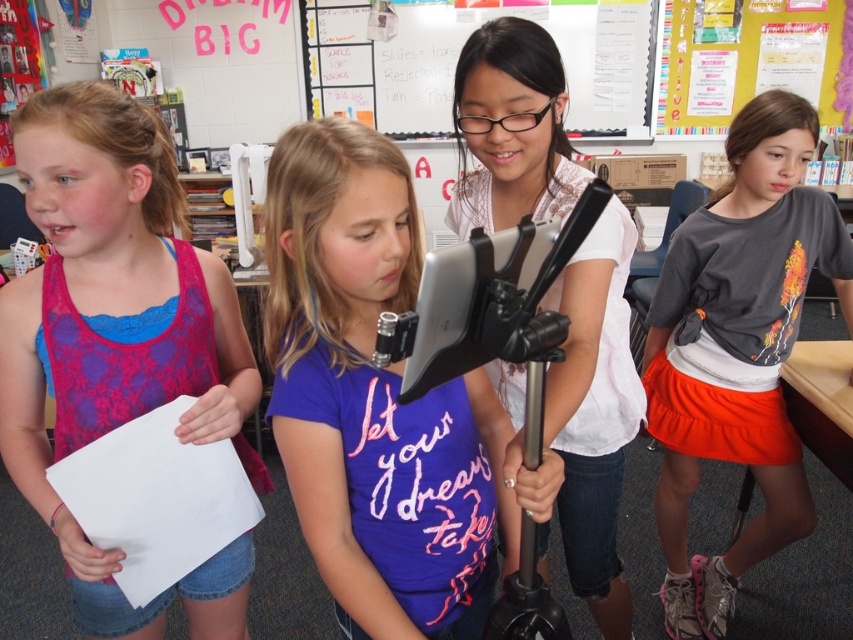
Is purple matte shirt at center further to camera compared to gray cotton shirt at center?

No, purple matte shirt at center is in front of gray cotton shirt at center.

Does purple matte shirt at center appear on the left side of gray cotton shirt at center?

Correct, you'll find purple matte shirt at center to the left of gray cotton shirt at center.

Which is in front, point (321, 576) or point (708, 346)?

Positioned in front is point (321, 576).

At what (x,y) coordinates should I click in order to perform the action: click on purple matte shirt at center. Please return your answer as a coordinate pair (x, y). This screenshot has height=640, width=853. Looking at the image, I should click on (374, 401).

Is point (611, 588) positioned before point (392, 61)?

Yes, point (611, 588) is closer to viewer.

Between point (503, 378) and point (450, 120), which one is positioned in front?

Positioned in front is point (503, 378).

Does point (581, 288) come closer to viewer compared to point (624, 8)?

Yes, it is in front of point (624, 8).

You are a GUI agent. You are given a task and a screenshot of the screen. Output one action in this format:
    pyautogui.click(x=<x>, y=<y>)
    Task: Click on the white lace shirt at center
    The image size is (853, 640).
    Given the screenshot: What is the action you would take?
    pyautogui.click(x=595, y=416)

Does purple matte shirt at center have a greater width compared to whiteboard at upper center?

Incorrect, purple matte shirt at center's width does not surpass whiteboard at upper center's.

Between point (389, 438) and point (550, 20), which one is positioned behind?

Positioned behind is point (550, 20).

Locate an element on the screen. purple matte shirt at center is located at coordinates (374, 401).